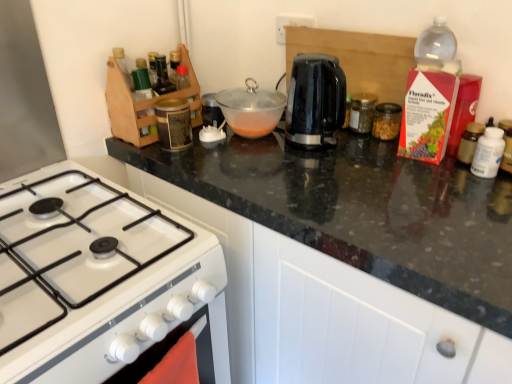
The height and width of the screenshot is (384, 512). Identify the location of vacant space in front of translucent plastic bottle at right, which is the 1th kitchen appliance from right to left. (471, 194).